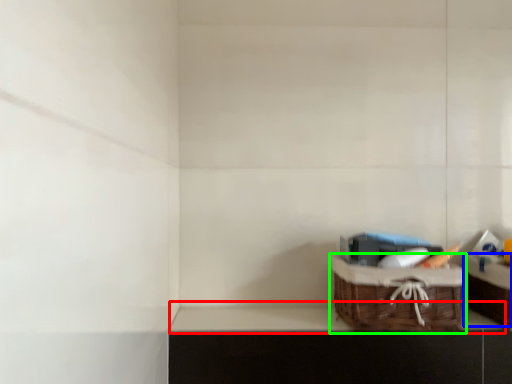
Question: Which object is positioned farthest from window sill (highlighted by a red box)? Select from cabinetry (highlighted by a blue box) and picnic basket (highlighted by a green box).

Choices:
 (A) cabinetry
 (B) picnic basket

Answer: (A)